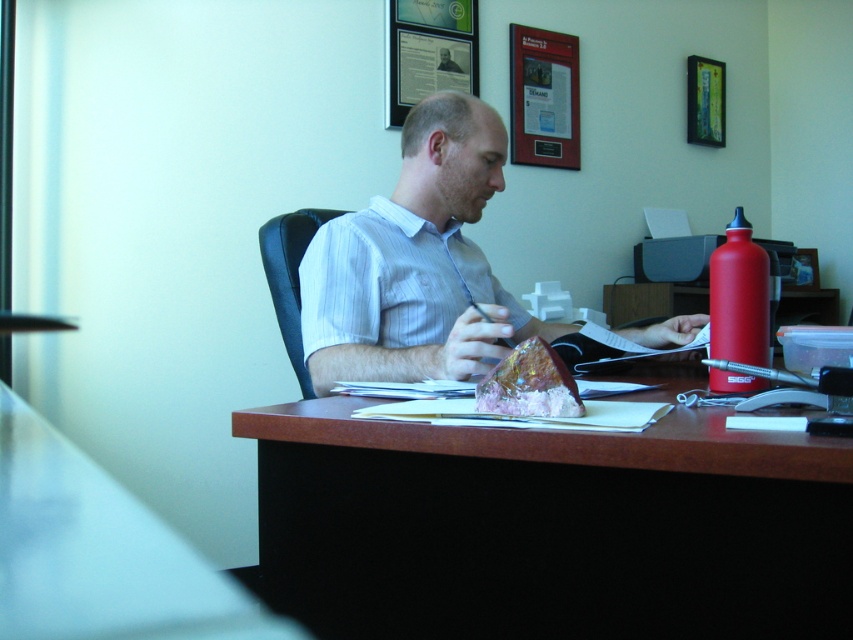
Question: Which of the following is the farthest from the observer?

Choices:
 (A) wooden desk at lower center
 (B) translucent pink crystal at desk center
 (C) matte white shirt at center

Answer: (A)

Question: From the image, what is the correct spatial relationship of brown wood desk at center in relation to matte white shirt at center?

Choices:
 (A) above
 (B) below

Answer: (B)

Question: Can you confirm if wooden desk at lower center is positioned to the left of translucent pink crystal at desk center?

Choices:
 (A) yes
 (B) no

Answer: (A)

Question: Which object appears farthest from the camera in this image?

Choices:
 (A) brown wood desk at center
 (B) matte white shirt at center
 (C) wooden desk at lower center
 (D) translucent pink crystal at desk center

Answer: (C)

Question: Can you confirm if brown wood desk at center is positioned to the left of metallic framed poster at upper center?

Choices:
 (A) yes
 (B) no

Answer: (A)

Question: Which point is farther to the camera?

Choices:
 (A) (532, 164)
 (B) (718, 472)
 (C) (105, 534)

Answer: (A)